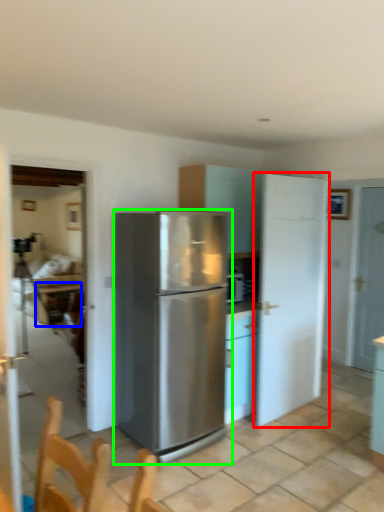
Question: Estimate the real-world distances between objects in this image. Which object is farther from door (highlighted by a red box), table (highlighted by a blue box) or refrigerator (highlighted by a green box)?

Choices:
 (A) table
 (B) refrigerator

Answer: (A)